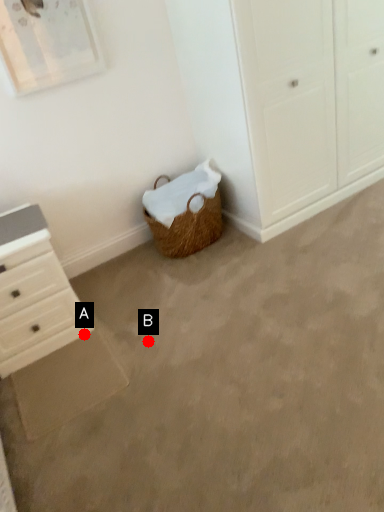
Question: Two points are circled on the image, labeled by A and B beside each circle. Which point appears closest to the camera in this image?

Choices:
 (A) A is closer
 (B) B is closer

Answer: (B)